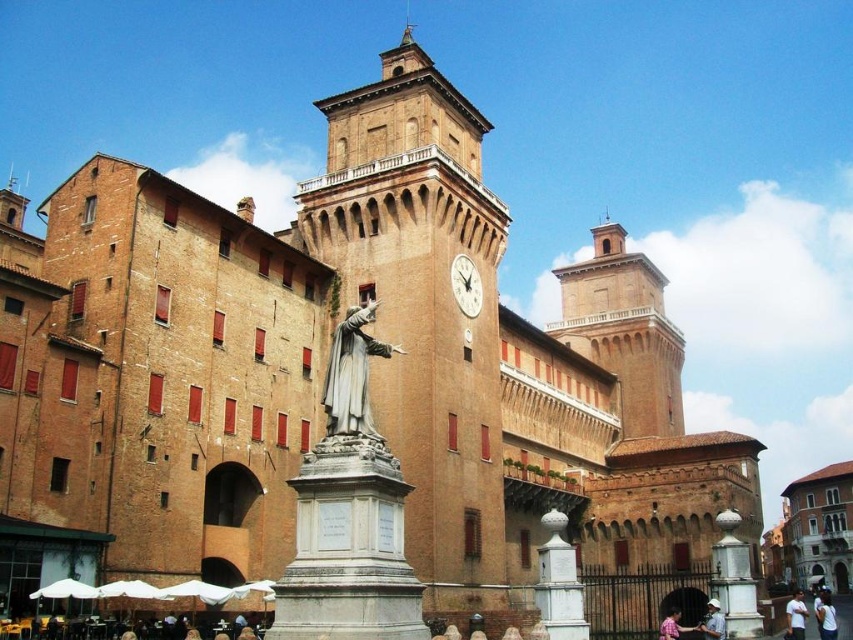
Question: Among these points, which one is farthest from the camera?

Choices:
 (A) (672, 612)
 (B) (802, 634)

Answer: (B)

Question: Which object is closer to the camera taking this photo?

Choices:
 (A) brown brick tower at upper center
 (B) polished bronze statue at center
 (C) brown brick clock tower at center

Answer: (B)

Question: Does white fabric shirt at center have a greater width compared to white fabric hat at lower center?

Choices:
 (A) no
 (B) yes

Answer: (B)

Question: Where is white cotton shirt at center located in relation to white fabric shirt at center in the image?

Choices:
 (A) left
 (B) right

Answer: (A)

Question: Is polished bronze statue at center wider than pink fabric shirt at lower center?

Choices:
 (A) no
 (B) yes

Answer: (A)

Question: Which object is the closest to the brown brick tower at upper center?

Choices:
 (A) white fabric shirt at center
 (B) pink fabric shirt at lower center
 (C) white cotton shirt at center
 (D) white fabric hat at lower center

Answer: (C)